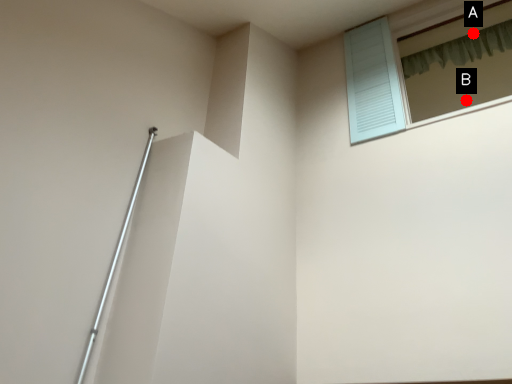
Question: Two points are circled on the image, labeled by A and B beside each circle. Which point is closer to the camera taking this photo?

Choices:
 (A) A is closer
 (B) B is closer

Answer: (A)